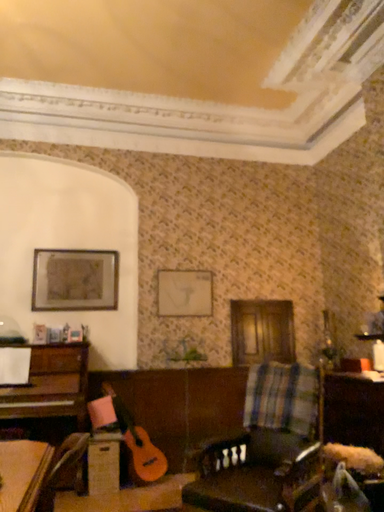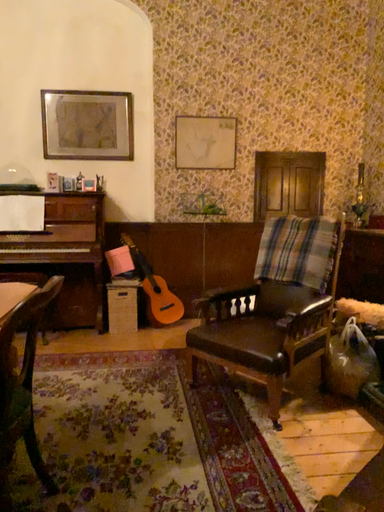
Question: How did the camera likely rotate when shooting the video?

Choices:
 (A) rotated downward
 (B) rotated upward

Answer: (A)